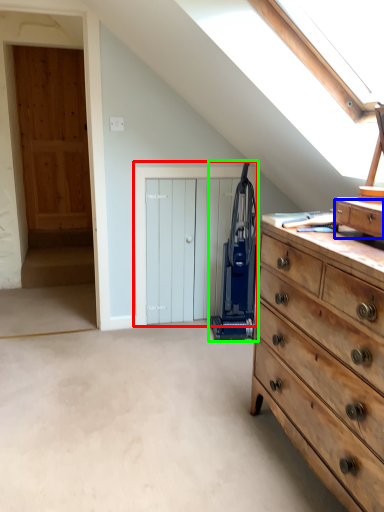
Question: Considering the real-world distances, which object is closest to door (highlighted by a red box)? drawer (highlighted by a blue box) or appliance (highlighted by a green box).

Choices:
 (A) drawer
 (B) appliance

Answer: (B)